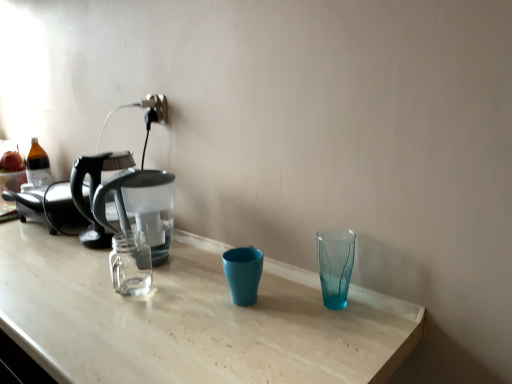
Question: Visually, is transparent glass shot glass at right positioned to the left or to the right of transparent plastic coffee maker at left?

Choices:
 (A) left
 (B) right

Answer: (B)

Question: From their relative heights in the image, would you say transparent glass shot glass at right is taller or shorter than transparent plastic coffee maker at left?

Choices:
 (A) tall
 (B) short

Answer: (B)

Question: Is transparent glass shot glass at right bigger or smaller than transparent plastic coffee maker at left?

Choices:
 (A) small
 (B) big

Answer: (A)

Question: Does point (164, 190) appear closer or farther from the camera than point (318, 240)?

Choices:
 (A) farther
 (B) closer

Answer: (A)

Question: From the image's perspective, relative to transparent glass shot glass at right, is transparent plastic coffee maker at left above or below?

Choices:
 (A) below
 (B) above

Answer: (B)

Question: From a real-world perspective, is transparent plastic coffee maker at left above or below transparent glass shot glass at right?

Choices:
 (A) above
 (B) below

Answer: (A)

Question: Is transparent plastic coffee maker at left spatially inside transparent glass shot glass at right, or outside of it?

Choices:
 (A) inside
 (B) outside

Answer: (B)